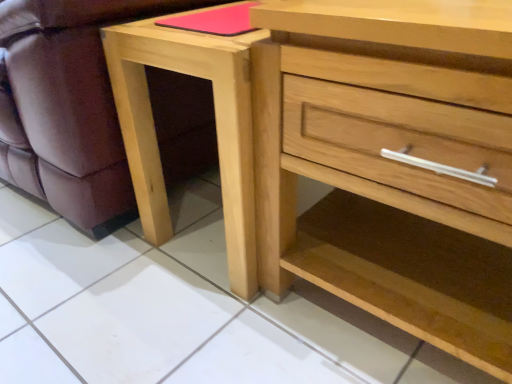
This screenshot has width=512, height=384. What do you see at coordinates (215, 123) in the screenshot? I see `natural wood nightstand at lower center` at bounding box center [215, 123].

The image size is (512, 384). What do you see at coordinates (391, 163) in the screenshot? I see `natural wood chest of drawers at center` at bounding box center [391, 163].

Identify the location of natural wood chest of drawers at center. (391, 163).

I want to click on natural wood nightstand at lower center, so click(215, 123).

From a real-world perspective, who is located lower, natural wood chest of drawers at center or matte wood swivel chair at lower left?

In real-world perspective, natural wood chest of drawers at center is lower.

Is matte wood swivel chair at lower left at the back of natural wood chest of drawers at center?

No, natural wood chest of drawers at center is not facing the opposite direction of matte wood swivel chair at lower left.

Considering the relative sizes of natural wood nightstand at lower center and matte wood swivel chair at lower left in the image provided, is natural wood nightstand at lower center smaller than matte wood swivel chair at lower left?

Yes.

Between point (209, 46) and point (100, 204), which one is positioned in front?

Positioned in front is point (209, 46).

From a real-world perspective, is natural wood nightstand at lower center above or below matte wood swivel chair at lower left?

In terms of real-world spatial position, natural wood nightstand at lower center is below matte wood swivel chair at lower left.

Is natural wood nightstand at lower center far away from matte wood swivel chair at lower left?

They are positioned close to each other.

How distant is matte wood swivel chair at lower left from natural wood chest of drawers at center?

matte wood swivel chair at lower left and natural wood chest of drawers at center are 19.62 inches apart.

From a real-world perspective, is matte wood swivel chair at lower left located higher than natural wood chest of drawers at center?

Yes, from a real-world perspective, matte wood swivel chair at lower left is above natural wood chest of drawers at center.

Considering the sizes of objects matte wood swivel chair at lower left and natural wood chest of drawers at center in the image provided, who is thinner, matte wood swivel chair at lower left or natural wood chest of drawers at center?

With smaller width is natural wood chest of drawers at center.

Between matte wood swivel chair at lower left and natural wood chest of drawers at center, which one has more height?

natural wood chest of drawers at center.

Is point (394, 74) positioned behind point (221, 109)?

No, (394, 74) is in front of (221, 109).

From the image's perspective, which is above, natural wood chest of drawers at center or natural wood nightstand at lower center?

From the image's view, natural wood nightstand at lower center is above.

Considering the sizes of objects natural wood chest of drawers at center and natural wood nightstand at lower center in the image provided, who is taller, natural wood chest of drawers at center or natural wood nightstand at lower center?

Standing taller between the two is natural wood chest of drawers at center.

Who is smaller, natural wood chest of drawers at center or natural wood nightstand at lower center?

Smaller between the two is natural wood nightstand at lower center.

Identify the location of nightstand lying above the natural wood chest of drawers at center (from the image's perspective). The height and width of the screenshot is (384, 512). (215, 123).

From the image's perspective, which one is positioned higher, natural wood nightstand at lower center or natural wood chest of drawers at center?

natural wood nightstand at lower center appears higher in the image.

Which of these two, natural wood nightstand at lower center or natural wood chest of drawers at center, is bigger?

natural wood chest of drawers at center.

Is matte wood swivel chair at lower left thinner than natural wood nightstand at lower center?

In fact, matte wood swivel chair at lower left might be wider than natural wood nightstand at lower center.

Which of these two, matte wood swivel chair at lower left or natural wood nightstand at lower center, is smaller?

Smaller between the two is natural wood nightstand at lower center.

Is the surface of matte wood swivel chair at lower left in direct contact with natural wood nightstand at lower center?

No, matte wood swivel chair at lower left is not next to natural wood nightstand at lower center.

The width and height of the screenshot is (512, 384). Identify the location of chest of drawers that is on the right side of matte wood swivel chair at lower left. (391, 163).

Find the location of a particular element. The height and width of the screenshot is (384, 512). swivel chair above the natural wood nightstand at lower center (from a real-world perspective) is located at coordinates (68, 107).

Considering their positions, is natural wood nightstand at lower center positioned closer to natural wood chest of drawers at center than matte wood swivel chair at lower left?

natural wood nightstand at lower center is positioned closer to the anchor natural wood chest of drawers at center.

Which object lies further to the anchor point matte wood swivel chair at lower left, natural wood chest of drawers at center or natural wood nightstand at lower center?

natural wood chest of drawers at center lies further to matte wood swivel chair at lower left than the other object.

Looking at the image, which one is located further to matte wood swivel chair at lower left, natural wood nightstand at lower center or natural wood chest of drawers at center?

Among the two, natural wood chest of drawers at center is located further to matte wood swivel chair at lower left.

Looking at this image, when comparing their distances from natural wood nightstand at lower center, does matte wood swivel chair at lower left or natural wood chest of drawers at center seem closer?

matte wood swivel chair at lower left is positioned closer to the anchor natural wood nightstand at lower center.

When comparing their distances from natural wood nightstand at lower center, does natural wood chest of drawers at center or matte wood swivel chair at lower left seem closer?

matte wood swivel chair at lower left is closer to natural wood nightstand at lower center.

Based on their spatial positions, is matte wood swivel chair at lower left or natural wood nightstand at lower center closer to natural wood chest of drawers at center?

natural wood nightstand at lower center is positioned closer to the anchor natural wood chest of drawers at center.

The height and width of the screenshot is (384, 512). In order to click on nightstand between matte wood swivel chair at lower left and natural wood chest of drawers at center in the horizontal direction in this screenshot , I will do `click(215, 123)`.